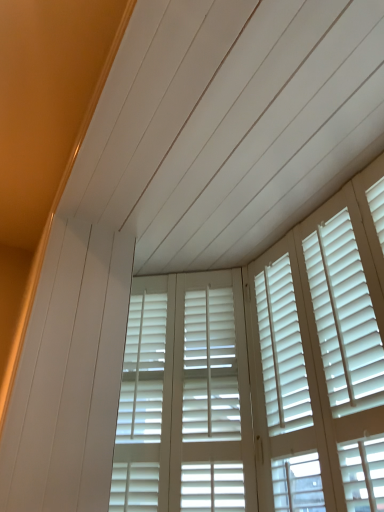
Question: Is white matte shutters at center in front of white wood blinds at center?

Choices:
 (A) yes
 (B) no

Answer: (B)

Question: Is white matte shutters at center outside of white wood blinds at center?

Choices:
 (A) no
 (B) yes

Answer: (B)

Question: Can you confirm if white matte shutters at center is taller than white wood blinds at center?

Choices:
 (A) no
 (B) yes

Answer: (A)

Question: Could you tell me if white matte shutters at center is facing white wood blinds at center?

Choices:
 (A) no
 (B) yes

Answer: (B)

Question: Is white matte shutters at center behind white wood blinds at center?

Choices:
 (A) yes
 (B) no

Answer: (A)

Question: Considering the relative sizes of white matte shutters at center and white wood blinds at center in the image provided, is white matte shutters at center wider than white wood blinds at center?

Choices:
 (A) no
 (B) yes

Answer: (B)

Question: Is white wood blinds at center positioned before white matte shutters at center?

Choices:
 (A) no
 (B) yes

Answer: (B)

Question: Is white wood blinds at center aimed at white matte shutters at center?

Choices:
 (A) no
 (B) yes

Answer: (A)

Question: Is white wood blinds at center taller than white matte shutters at center?

Choices:
 (A) yes
 (B) no

Answer: (A)

Question: Is white wood blinds at center next to white matte shutters at center and touching it?

Choices:
 (A) yes
 (B) no

Answer: (B)

Question: Does white wood blinds at center lie behind white matte shutters at center?

Choices:
 (A) no
 (B) yes

Answer: (A)

Question: Does white wood blinds at center have a lesser width compared to white matte shutters at center?

Choices:
 (A) no
 (B) yes

Answer: (B)

Question: Do you think white matte shutters at center is within white wood blinds at center, or outside of it?

Choices:
 (A) inside
 (B) outside

Answer: (B)